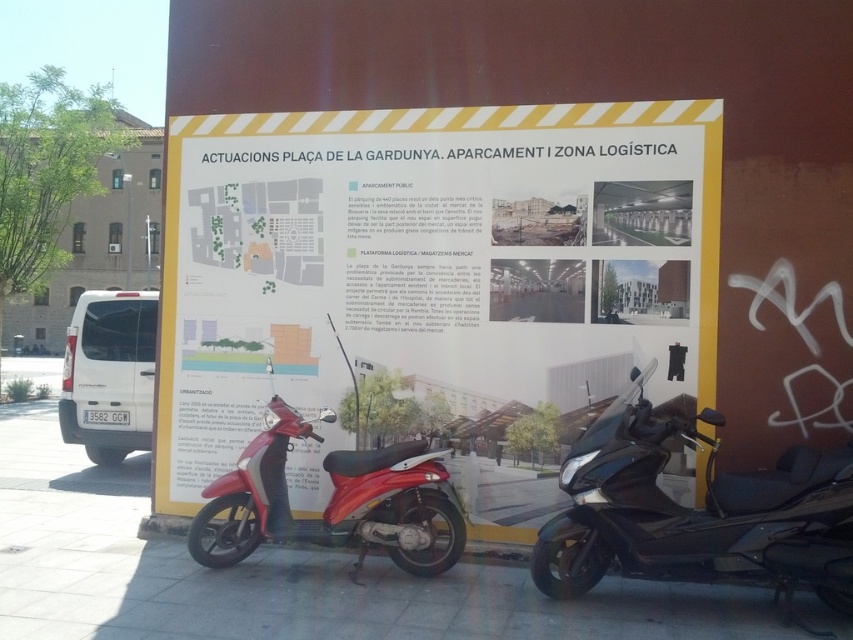
You are a pedestrian standing in front of the public information board. You notice the yellow paper poster at center and the shiny black scooter at lower right. Which object is closer to you?

The yellow paper poster at center is closer to you because the shiny black scooter at lower right is behind it.

From the picture: You are a delivery person who needs to attach a package to the shiny black scooter at lower right. The package is too big to carry, so you decide to place it on the ground next to the yellow paper poster at center. Will the package fit next to the poster without overlapping it?

The yellow paper poster at center has a larger size compared to shiny black scooter at lower right, so the package can be placed next to the poster without overlapping since there is enough space around the larger poster.

You are a delivery person who needs to attach a parcel to the shiny black scooter at lower right. The parcel is as wide as the yellow paper poster at center. Will the parcel fit on the scooter?

The yellow paper poster at center is wider than the shiny black scooter at lower right, so the parcel, which is as wide as the poster, will not fit on the scooter.